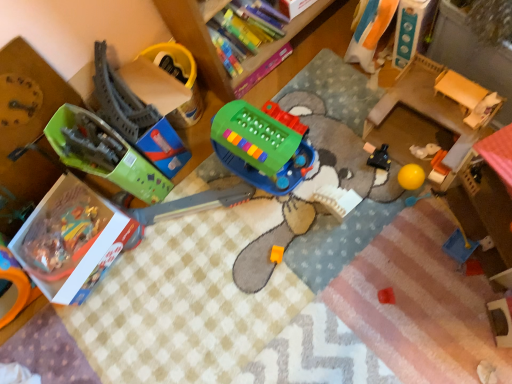
Where is `free space between black plastic toy at center-right, which is the 5th toy in left-to-right order, and blue plastic dustpan at lower right, which ranks as the 1th toy in right-to-left order`? The width and height of the screenshot is (512, 384). free space between black plastic toy at center-right, which is the 5th toy in left-to-right order, and blue plastic dustpan at lower right, which ranks as the 1th toy in right-to-left order is located at coordinates pos(417,208).